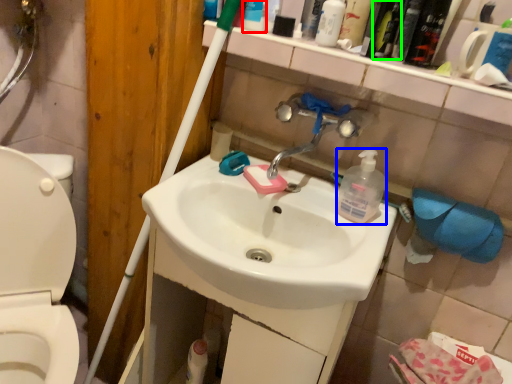
Question: Estimate the real-world distances between objects in this image. Which object is closer to toiletry (highlighted by a red box), cleaning product (highlighted by a blue box) or mouthwash (highlighted by a green box)?

Choices:
 (A) cleaning product
 (B) mouthwash

Answer: (B)